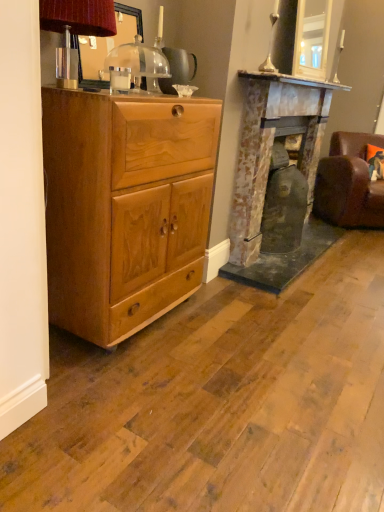
Measure the distance between light brown wood chest of drawers at left and camera.

The depth of light brown wood chest of drawers at left is 1.46 meters.

Locate an element on the screen. This screenshot has height=512, width=384. brown leather swivel chair at right is located at coordinates (349, 183).

Where is `light brown wood chest of drawers at left`? Image resolution: width=384 pixels, height=512 pixels. light brown wood chest of drawers at left is located at coordinates (125, 207).

Considering the sizes of objects matte brown lampshade at upper left and rustic stone fireplace at center in the image provided, who is thinner, matte brown lampshade at upper left or rustic stone fireplace at center?

Thinner between the two is matte brown lampshade at upper left.

Can you confirm if matte brown lampshade at upper left is positioned to the right of rustic stone fireplace at center?

No.

In the image, is matte brown lampshade at upper left positioned in front of or behind rustic stone fireplace at center?

Clearly, matte brown lampshade at upper left is in front of rustic stone fireplace at center.

Is matte brown lampshade at upper left positioned with its back to rustic stone fireplace at center?

No, matte brown lampshade at upper left is not facing the opposite direction of rustic stone fireplace at center.

Which of these two, rustic stone fireplace at center or matte brown lampshade at upper left, is thinner?

Thinner between the two is matte brown lampshade at upper left.

From the image's perspective, is rustic stone fireplace at center above or below matte brown lampshade at upper left?

rustic stone fireplace at center is situated lower than matte brown lampshade at upper left in the image.

From the picture: How far apart are rustic stone fireplace at center and matte brown lampshade at upper left?

rustic stone fireplace at center and matte brown lampshade at upper left are 1.47 meters apart.

From a real-world perspective, between rustic stone fireplace at center and matte brown lampshade at upper left, who is vertically lower?

rustic stone fireplace at center.

Consider the image. Would you consider matte brown lampshade at upper left to be distant from brown leather swivel chair at right?

matte brown lampshade at upper left is positioned a significant distance from brown leather swivel chair at right.

Image resolution: width=384 pixels, height=512 pixels. Find the location of `swivel chair on the right of matte brown lampshade at upper left`. swivel chair on the right of matte brown lampshade at upper left is located at coordinates (349, 183).

Is matte brown lampshade at upper left to the left of brown leather swivel chair at right from the viewer's perspective?

Yes.

Is matte brown lampshade at upper left oriented away from brown leather swivel chair at right?

No.

Does point (348, 190) appear closer or farther from the camera than point (147, 101)?

Point (348, 190) is positioned farther from the camera compared to point (147, 101).

In the image, is brown leather swivel chair at right on the left side or the right side of light brown wood chest of drawers at left?

In the image, brown leather swivel chair at right appears on the right side of light brown wood chest of drawers at left.

In terms of height, does brown leather swivel chair at right look taller or shorter compared to light brown wood chest of drawers at left?

Considering their sizes, brown leather swivel chair at right has less height than light brown wood chest of drawers at left.

From the image's perspective, between brown leather swivel chair at right and light brown wood chest of drawers at left, which one is located above?

brown leather swivel chair at right is shown above in the image.

Considering the relative sizes of light brown wood chest of drawers at left and rustic stone fireplace at center in the image provided, is light brown wood chest of drawers at left thinner than rustic stone fireplace at center?

No, light brown wood chest of drawers at left is not thinner than rustic stone fireplace at center.

From a real-world perspective, does light brown wood chest of drawers at left sit lower than rustic stone fireplace at center?

Correct, in the physical world, light brown wood chest of drawers at left is lower than rustic stone fireplace at center.

Find the location of `chest of drawers on the left of rustic stone fireplace at center`. chest of drawers on the left of rustic stone fireplace at center is located at coordinates (125, 207).

Does light brown wood chest of drawers at left appear on the left side of rustic stone fireplace at center?

Correct, you'll find light brown wood chest of drawers at left to the left of rustic stone fireplace at center.

Does light brown wood chest of drawers at left contain matte brown lampshade at upper left?

No, matte brown lampshade at upper left is not surrounded by light brown wood chest of drawers at left.

Is light brown wood chest of drawers at left aimed at matte brown lampshade at upper left?

No.

From a real-world perspective, which object rests below the other?

light brown wood chest of drawers at left is physically lower.

Would you say light brown wood chest of drawers at left is to the left or to the right of matte brown lampshade at upper left in the picture?

Clearly, light brown wood chest of drawers at left is on the right of matte brown lampshade at upper left in the image.

From the image's perspective, is rustic stone fireplace at center above or below brown leather swivel chair at right?

rustic stone fireplace at center is below brown leather swivel chair at right.

Is rustic stone fireplace at center not near brown leather swivel chair at right?

No.

How much distance is there between rustic stone fireplace at center and brown leather swivel chair at right?

79.68 centimeters.

Between rustic stone fireplace at center and brown leather swivel chair at right, which one appears on the right side from the viewer's perspective?

brown leather swivel chair at right is more to the right.

This screenshot has width=384, height=512. Find the location of `table lamp in front of the rustic stone fireplace at center`. table lamp in front of the rustic stone fireplace at center is located at coordinates (75, 29).

Locate an element on the screen. This screenshot has width=384, height=512. table lamp that is above the rustic stone fireplace at center (from the image's perspective) is located at coordinates (75, 29).

Based on their spatial positions, is rustic stone fireplace at center or brown leather swivel chair at right further from light brown wood chest of drawers at left?

Based on the image, brown leather swivel chair at right appears to be further to light brown wood chest of drawers at left.

Looking at this image, from the image, which object appears to be farther from rustic stone fireplace at center, brown leather swivel chair at right or light brown wood chest of drawers at left?

light brown wood chest of drawers at left.

Based on their spatial positions, is rustic stone fireplace at center or matte brown lampshade at upper left closer to brown leather swivel chair at right?

Among the two, rustic stone fireplace at center is located nearer to brown leather swivel chair at right.

Which object lies further to the anchor point matte brown lampshade at upper left, rustic stone fireplace at center or light brown wood chest of drawers at left?

rustic stone fireplace at center is positioned further to the anchor matte brown lampshade at upper left.

Which object lies further to the anchor point brown leather swivel chair at right, rustic stone fireplace at center or light brown wood chest of drawers at left?

light brown wood chest of drawers at left is positioned further to the anchor brown leather swivel chair at right.

Based on their spatial positions, is light brown wood chest of drawers at left or brown leather swivel chair at right closer to rustic stone fireplace at center?

brown leather swivel chair at right.

Estimate the real-world distances between objects in this image. Which object is closer to rustic stone fireplace at center, brown leather swivel chair at right or matte brown lampshade at upper left?

Based on the image, brown leather swivel chair at right appears to be nearer to rustic stone fireplace at center.

Considering their positions, is rustic stone fireplace at center positioned further to matte brown lampshade at upper left than brown leather swivel chair at right?

brown leather swivel chair at right.

At what (x,y) coordinates should I click in order to perform the action: click on chest of drawers between matte brown lampshade at upper left and brown leather swivel chair at right along the z-axis. Please return your answer as a coordinate pair (x, y). This screenshot has height=512, width=384. Looking at the image, I should click on (125, 207).

Identify the location of the chest of drawers located between matte brown lampshade at upper left and rustic stone fireplace at center in the depth direction. (125, 207).

You are a GUI agent. You are given a task and a screenshot of the screen. Output one action in this format:
    pyautogui.click(x=<x>, y=<y>)
    Task: Click on the fireplace between matte brown lampshade at upper left and brown leather swivel chair at right along the z-axis
    
    Given the screenshot: What is the action you would take?
    pyautogui.click(x=278, y=181)

In order to click on fireplace positioned between light brown wood chest of drawers at left and brown leather swivel chair at right from near to far in this screenshot , I will do `click(278, 181)`.